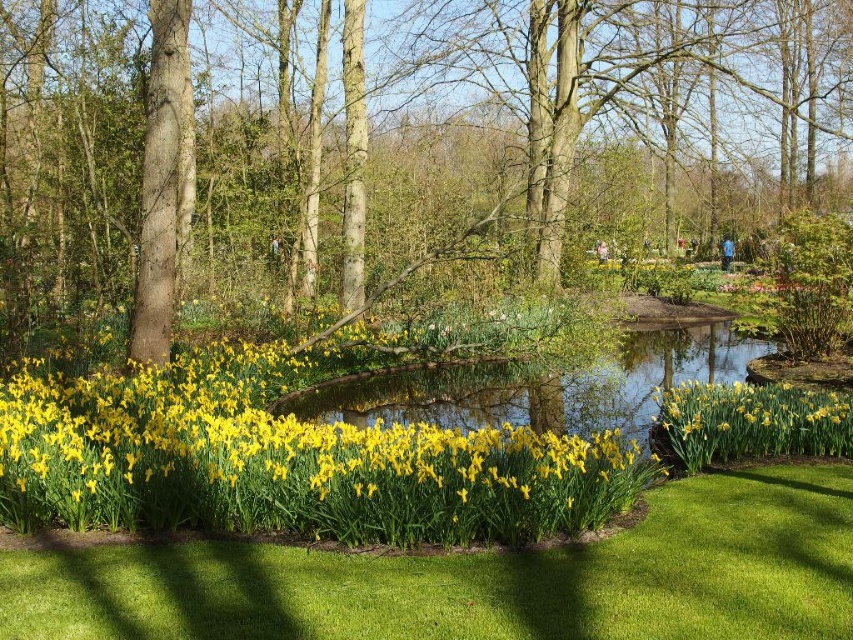
Between green leafy tree at center and yellow matte daffodil at lower center, which one has more height?

With more height is green leafy tree at center.

Who is more distant from viewer, (523, 241) or (708, 422)?

The point (523, 241) is behind.

This screenshot has width=853, height=640. I want to click on green leafy tree at center, so click(392, 147).

Image resolution: width=853 pixels, height=640 pixels. Find the location of `green leafy tree at center`. green leafy tree at center is located at coordinates (392, 147).

Is green leafy tree at center further to camera compared to yellow matte flowers at lower left?

Yes, it is behind yellow matte flowers at lower left.

Does green leafy tree at center have a lesser height compared to yellow matte flowers at lower left?

No, green leafy tree at center is not shorter than yellow matte flowers at lower left.

Is point (664, 1) more distant than point (292, 486)?

That is True.

The image size is (853, 640). I want to click on green leafy tree at center, so click(x=392, y=147).

From the picture: Who is positioned more to the left, green grass at lower center or yellow matte daffodil at lower center?

green grass at lower center

Does point (544, 621) lie behind point (706, 384)?

No, it is not.

Locate an element on the screen. green grass at lower center is located at coordinates (482, 579).